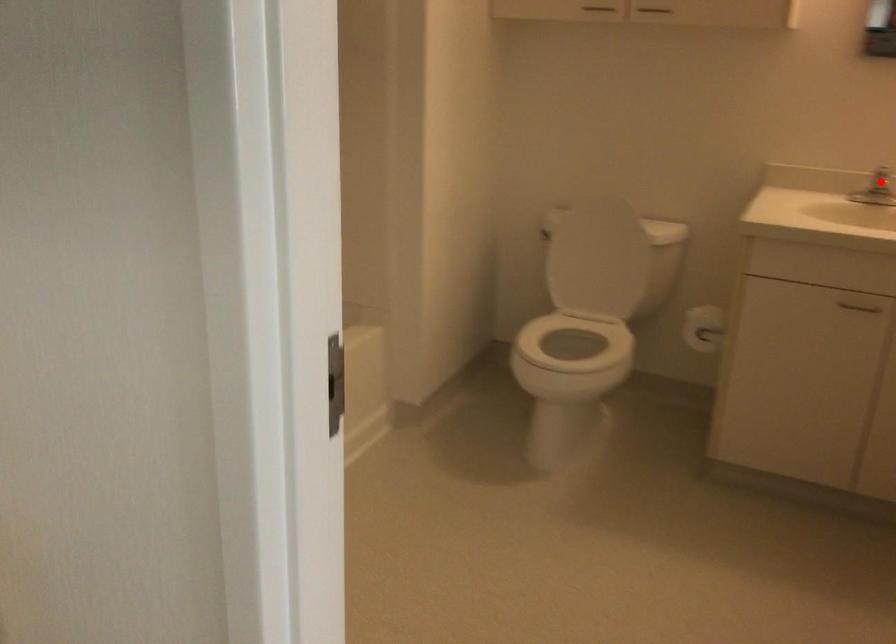
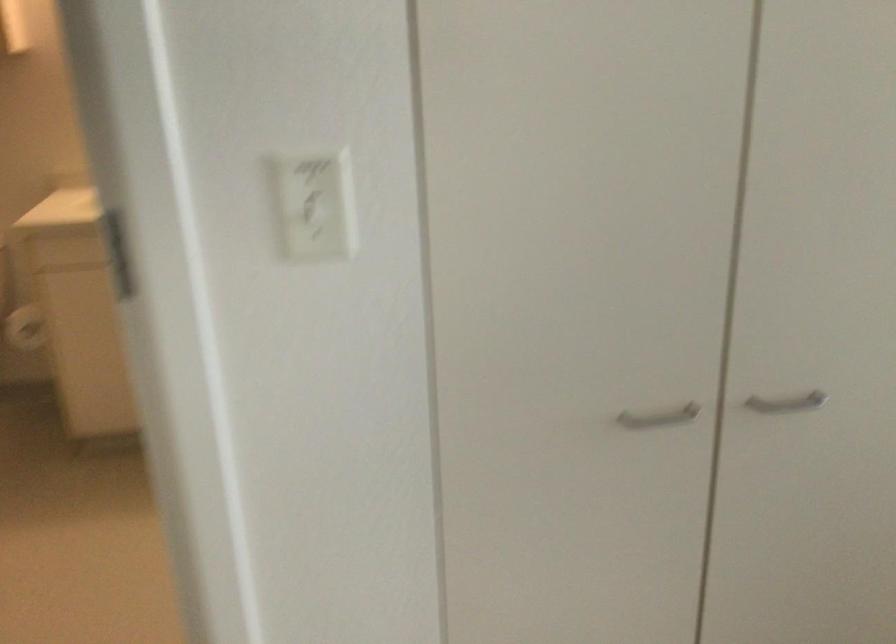
Question: I am providing you with two images of the same scene from different viewpoints. A red point is marked on the first image. Can you still see the location of the red point in image 2?

Choices:
 (A) Yes
 (B) No

Answer: (B)